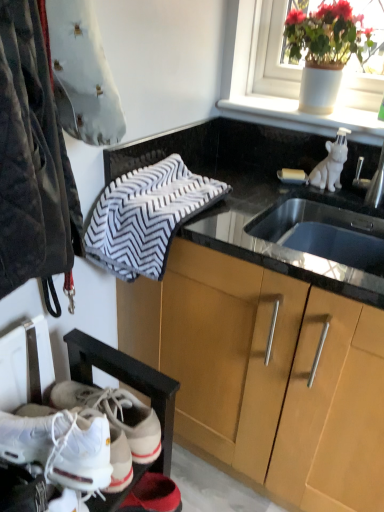
Question: Is white leather sneakers at lower left facing towards white ceramic pot at upper right?

Choices:
 (A) yes
 (B) no

Answer: (B)

Question: Is white leather sneakers at lower left to the right of white ceramic pot at upper right from the viewer's perspective?

Choices:
 (A) no
 (B) yes

Answer: (A)

Question: Can you confirm if white leather sneakers at lower left is taller than white ceramic pot at upper right?

Choices:
 (A) yes
 (B) no

Answer: (B)

Question: Can you confirm if white leather sneakers at lower left is thinner than white ceramic pot at upper right?

Choices:
 (A) yes
 (B) no

Answer: (B)

Question: From a real-world perspective, is white leather sneakers at lower left on white ceramic pot at upper right?

Choices:
 (A) no
 (B) yes

Answer: (A)

Question: Considering the positions of velvet-like gray pillow at upper left, the 1th animal viewed from the left, and white glossy ceramic dog at upper right, the 2th animal from the front, in the image, is velvet-like gray pillow at upper left, the 1th animal viewed from the left, bigger or smaller than white glossy ceramic dog at upper right, the 2th animal from the front,?

Choices:
 (A) big
 (B) small

Answer: (A)

Question: Would you say velvet-like gray pillow at upper left, which is counted as the second animal, starting from the right, is inside or outside white glossy ceramic dog at upper right, the 1th animal viewed from the right?

Choices:
 (A) outside
 (B) inside

Answer: (A)

Question: In the image, is velvet-like gray pillow at upper left, the first animal in the front-to-back sequence, positioned in front of or behind white glossy ceramic dog at upper right, which is counted as the 2th animal, starting from the left?

Choices:
 (A) front
 (B) behind

Answer: (A)

Question: Is velvet-like gray pillow at upper left, which is counted as the second animal, starting from the right, taller or shorter than white glossy ceramic dog at upper right, the 1th animal viewed from the right?

Choices:
 (A) tall
 (B) short

Answer: (A)

Question: Is point (370, 474) closer or farther from the camera than point (342, 132)?

Choices:
 (A) farther
 (B) closer

Answer: (B)

Question: In terms of size, does wooden cabinet at center appear bigger or smaller than white glossy ceramic dog at upper right, the 2th animal from the front?

Choices:
 (A) big
 (B) small

Answer: (A)

Question: From a real-world perspective, relative to white glossy ceramic dog at upper right, which is counted as the 2th animal, starting from the left, is wooden cabinet at center vertically above or below?

Choices:
 (A) above
 (B) below

Answer: (B)

Question: Is wooden cabinet at center wider or thinner than white glossy ceramic dog at upper right, the 1th animal viewed from the right?

Choices:
 (A) thin
 (B) wide

Answer: (B)

Question: From a real-world perspective, is gray textured towel at upper center above or below velvet-like gray pillow at upper left, the first animal in the front-to-back sequence?

Choices:
 (A) above
 (B) below

Answer: (B)

Question: In terms of width, does gray textured towel at upper center look wider or thinner when compared to velvet-like gray pillow at upper left, the first animal in the front-to-back sequence?

Choices:
 (A) thin
 (B) wide

Answer: (B)